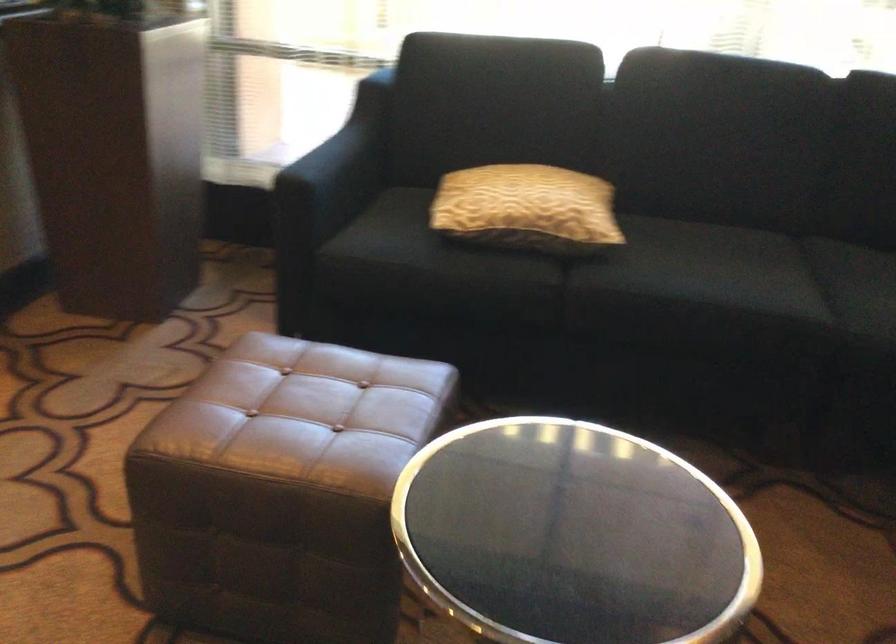
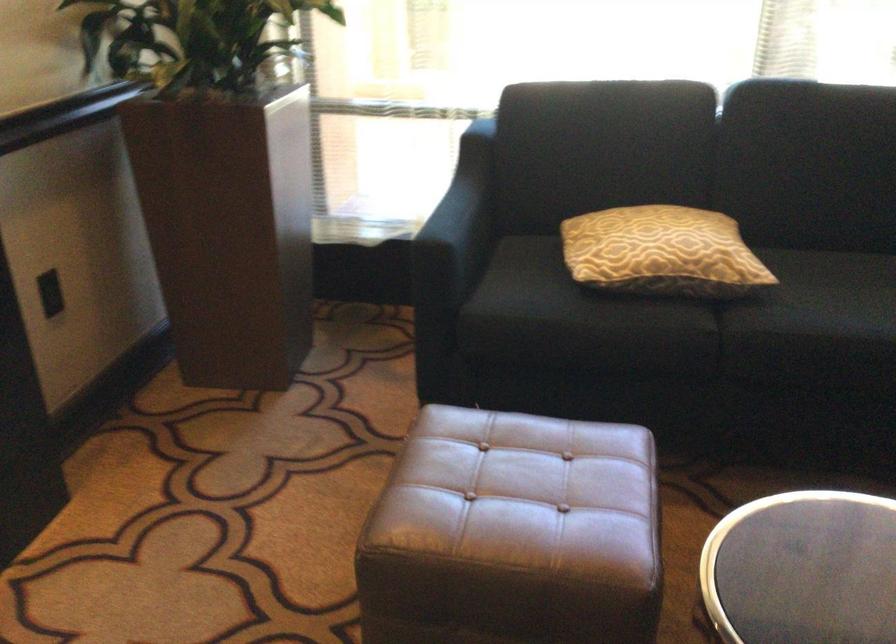
Find the pixel in the second image that matches (313,417) in the first image.

(522, 495)